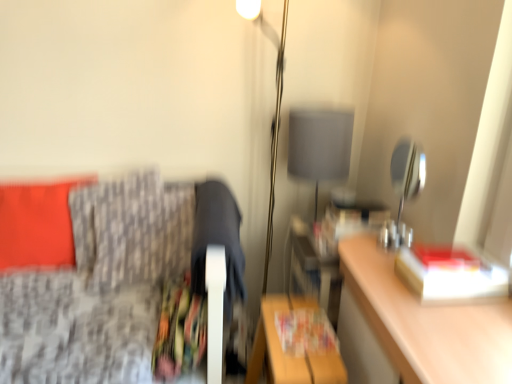
Question: Is the depth of wooden table at lower center greater than that of patterned fabric pillow at left, which is the 1th pillow in right-to-left order?

Choices:
 (A) yes
 (B) no

Answer: (B)

Question: Can you confirm if wooden table at lower center is positioned to the right of patterned fabric pillow at left, which is the 1th pillow in right-to-left order?

Choices:
 (A) yes
 (B) no

Answer: (A)

Question: Can you confirm if wooden table at lower center is smaller than patterned fabric pillow at left, which is the second pillow in left-to-right order?

Choices:
 (A) yes
 (B) no

Answer: (B)

Question: Does wooden table at lower center have a lesser width compared to patterned fabric pillow at left, which is the second pillow in left-to-right order?

Choices:
 (A) yes
 (B) no

Answer: (B)

Question: From the image's perspective, does wooden table at lower center appear lower than patterned fabric pillow at left, which is the second pillow in left-to-right order?

Choices:
 (A) no
 (B) yes

Answer: (B)

Question: Considering the positions of point (305, 155) and point (136, 221), is point (305, 155) closer or farther from the camera than point (136, 221)?

Choices:
 (A) closer
 (B) farther

Answer: (B)

Question: Based on their sizes in the image, would you say matte gray lampshade at center, which is counted as the 1th table lamp, starting from the back, is bigger or smaller than patterned fabric pillow at left, which is the 1th pillow in right-to-left order?

Choices:
 (A) big
 (B) small

Answer: (B)

Question: Is matte gray lampshade at center, the 2th table lamp in the front-to-back sequence, wider or thinner than patterned fabric pillow at left, which is the second pillow in left-to-right order?

Choices:
 (A) thin
 (B) wide

Answer: (A)

Question: Choose the correct answer: Is matte gray lampshade at center, the 2th table lamp when ordered from right to left, inside patterned fabric pillow at left, which is the 1th pillow in right-to-left order, or outside it?

Choices:
 (A) inside
 (B) outside

Answer: (B)

Question: Do you think matte paper magazine at center, the 2th magazine in the front-to-back sequence, is within wooden table at lower center, or outside of it?

Choices:
 (A) inside
 (B) outside

Answer: (B)

Question: In terms of height, does matte paper magazine at center, which is the 1th magazine from top to bottom, look taller or shorter compared to wooden table at lower center?

Choices:
 (A) tall
 (B) short

Answer: (B)

Question: Considering the positions of matte paper magazine at center, the first magazine viewed from the back, and wooden table at lower center in the image, is matte paper magazine at center, the first magazine viewed from the back, bigger or smaller than wooden table at lower center?

Choices:
 (A) small
 (B) big

Answer: (A)

Question: Does point (361, 205) appear closer or farther from the camera than point (260, 322)?

Choices:
 (A) farther
 (B) closer

Answer: (A)

Question: Considering the positions of metallic gray lampshade at upper right, positioned as the first table lamp in right-to-left order, and hardcover book at right in the image, is metallic gray lampshade at upper right, positioned as the first table lamp in right-to-left order, wider or thinner than hardcover book at right?

Choices:
 (A) thin
 (B) wide

Answer: (A)

Question: Considering their positions, is metallic gray lampshade at upper right, which is counted as the 1th table lamp, starting from the front, located in front of or behind hardcover book at right?

Choices:
 (A) front
 (B) behind

Answer: (B)